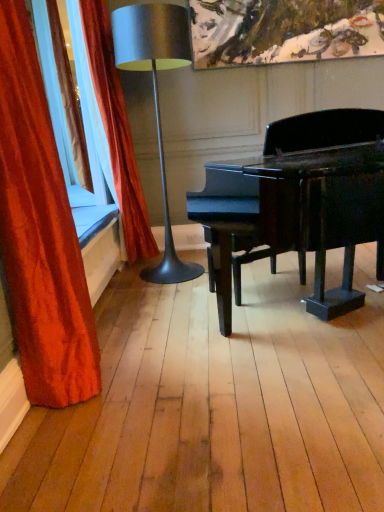
Question: Is velvet red curtain at left, the 1th curtain from the back, taller than velvet red curtain at left, the second curtain viewed from the back?

Choices:
 (A) no
 (B) yes

Answer: (B)

Question: Can you confirm if velvet red curtain at left, acting as the second curtain starting from the front, is wider than velvet red curtain at left, the second curtain viewed from the back?

Choices:
 (A) yes
 (B) no

Answer: (A)

Question: Is the depth of velvet red curtain at left, acting as the second curtain starting from the front, less than that of velvet red curtain at left, acting as the first curtain starting from the front?

Choices:
 (A) no
 (B) yes

Answer: (A)

Question: Considering the relative sizes of velvet red curtain at left, the 1th curtain from the back, and velvet red curtain at left, acting as the first curtain starting from the front, in the image provided, is velvet red curtain at left, the 1th curtain from the back, shorter than velvet red curtain at left, acting as the first curtain starting from the front,?

Choices:
 (A) no
 (B) yes

Answer: (A)

Question: Considering the relative positions of velvet red curtain at left, acting as the second curtain starting from the front, and velvet red curtain at left, acting as the first curtain starting from the front, in the image provided, is velvet red curtain at left, acting as the second curtain starting from the front, to the left of velvet red curtain at left, acting as the first curtain starting from the front, from the viewer's perspective?

Choices:
 (A) yes
 (B) no

Answer: (B)

Question: From the image's perspective, is velvet red curtain at left, the 1th curtain from the back, under velvet red curtain at left, the second curtain viewed from the back?

Choices:
 (A) no
 (B) yes

Answer: (A)

Question: Considering the relative sizes of velvet red curtain at left, the second curtain viewed from the back, and velvet red curtain at left, the 1th curtain from the back, in the image provided, is velvet red curtain at left, the second curtain viewed from the back, shorter than velvet red curtain at left, the 1th curtain from the back,?

Choices:
 (A) no
 (B) yes

Answer: (B)

Question: Can you confirm if velvet red curtain at left, the second curtain viewed from the back, is bigger than velvet red curtain at left, acting as the second curtain starting from the front?

Choices:
 (A) yes
 (B) no

Answer: (B)

Question: From the image's perspective, is velvet red curtain at left, the second curtain viewed from the back, above velvet red curtain at left, acting as the second curtain starting from the front?

Choices:
 (A) no
 (B) yes

Answer: (A)

Question: Is velvet red curtain at left, the second curtain viewed from the back, next to velvet red curtain at left, acting as the second curtain starting from the front?

Choices:
 (A) no
 (B) yes

Answer: (A)

Question: Considering the relative sizes of velvet red curtain at left, the second curtain viewed from the back, and velvet red curtain at left, acting as the second curtain starting from the front, in the image provided, is velvet red curtain at left, the second curtain viewed from the back, thinner than velvet red curtain at left, acting as the second curtain starting from the front,?

Choices:
 (A) yes
 (B) no

Answer: (A)

Question: Is velvet red curtain at left, the second curtain viewed from the back, not near velvet red curtain at left, the 1th curtain from the back?

Choices:
 (A) no
 (B) yes

Answer: (B)

Question: Is metallic silver lamp at left at the right side of velvet red curtain at left, acting as the first curtain starting from the front?

Choices:
 (A) no
 (B) yes

Answer: (B)